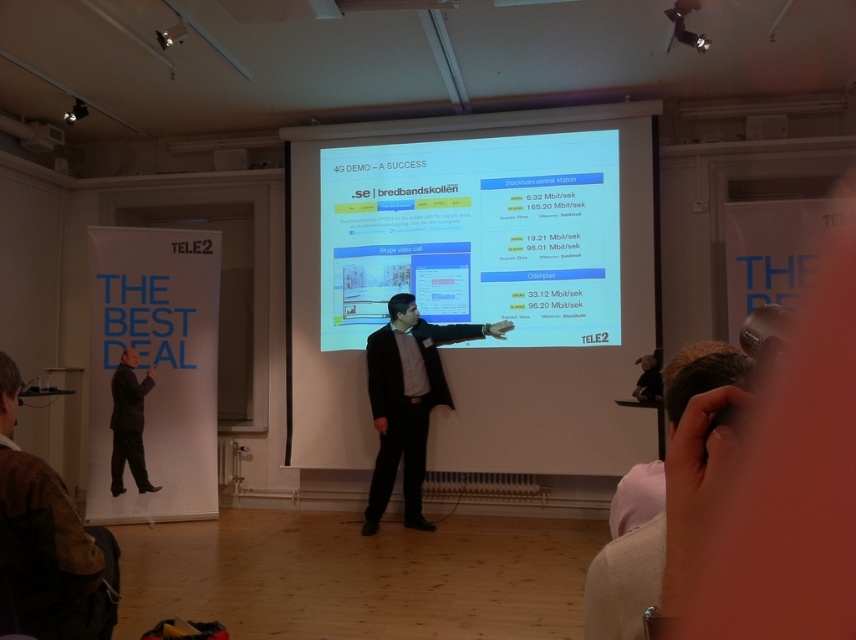
You are an event organizer setting up for a tech conference. You have two screens available for the keynote speech. The scene shows a matte white projector screen at center and a white glossy projector screen at center. Which screen is positioned to the left?

The matte white projector screen at center is positioned to the left of the white glossy projector screen at center.

You are an attendee at the presentation. You need to refer to both the matte white projector screen at center and the white paperboard at left. Which object is located to the right of the other?

The matte white projector screen at center is to the right of the white paperboard at left.

You are setting up a new projector in the room and need to align it with the matte white projector screen at center. According to the coordinates provided, where should the projector be positioned relative to the screen?

The matte white projector screen at center is located at point (479, 280), so the projector should be positioned directly facing this coordinate to ensure proper alignment with the screen.